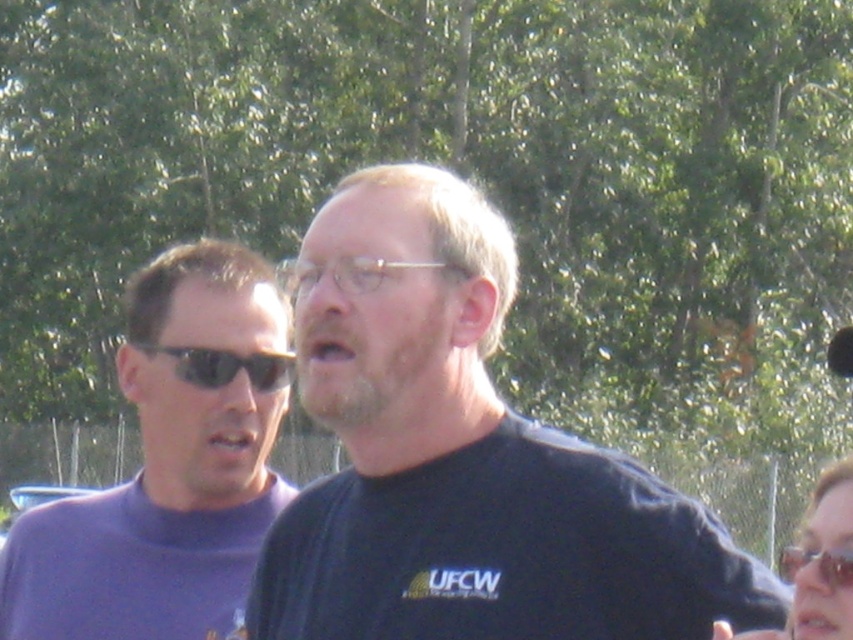
Does purple turtleneck sweater at left have a larger size compared to clear plastic goggles at center?

Indeed, purple turtleneck sweater at left has a larger size compared to clear plastic goggles at center.

Does purple turtleneck sweater at left have a greater height compared to clear plastic goggles at center?

Incorrect, purple turtleneck sweater at left's height is not larger of clear plastic goggles at center's.

Which is behind, point (39, 637) or point (814, 552)?

Point (39, 637)

Where is `purple turtleneck sweater at left`? purple turtleneck sweater at left is located at coordinates (170, 467).

Does black matte shirt at center appear under clear plastic goggles at center?

No.

Measure the distance between black matte shirt at center and clear plastic goggles at center.

black matte shirt at center and clear plastic goggles at center are 9.44 meters apart.

Does point (457, 356) lie behind point (779, 564)?

No, it is in front of (779, 564).

You are a GUI agent. You are given a task and a screenshot of the screen. Output one action in this format:
    pyautogui.click(x=<x>, y=<y>)
    Task: Click on the black matte shirt at center
    The height and width of the screenshot is (640, 853).
    Given the screenshot: What is the action you would take?
    pos(467,464)

Between black plastic sunglasses at left and clear plastic glasses at center, which one is positioned higher?

clear plastic glasses at center is higher up.

Can you confirm if black plastic sunglasses at left is thinner than clear plastic glasses at center?

Correct, black plastic sunglasses at left's width is less than clear plastic glasses at center's.

Locate an element on the screen. Image resolution: width=853 pixels, height=640 pixels. black plastic sunglasses at left is located at coordinates tap(225, 365).

Identify the location of black plastic sunglasses at left. (225, 365).